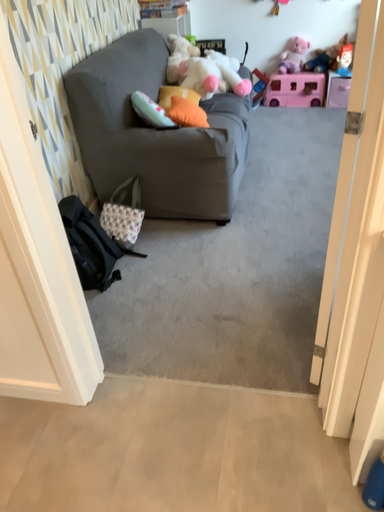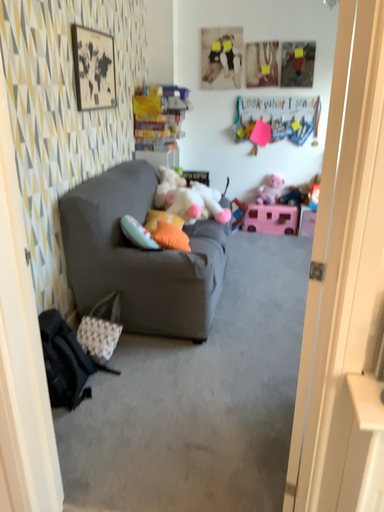
Question: Which way did the camera rotate in the video?

Choices:
 (A) rotated upward
 (B) rotated downward

Answer: (A)